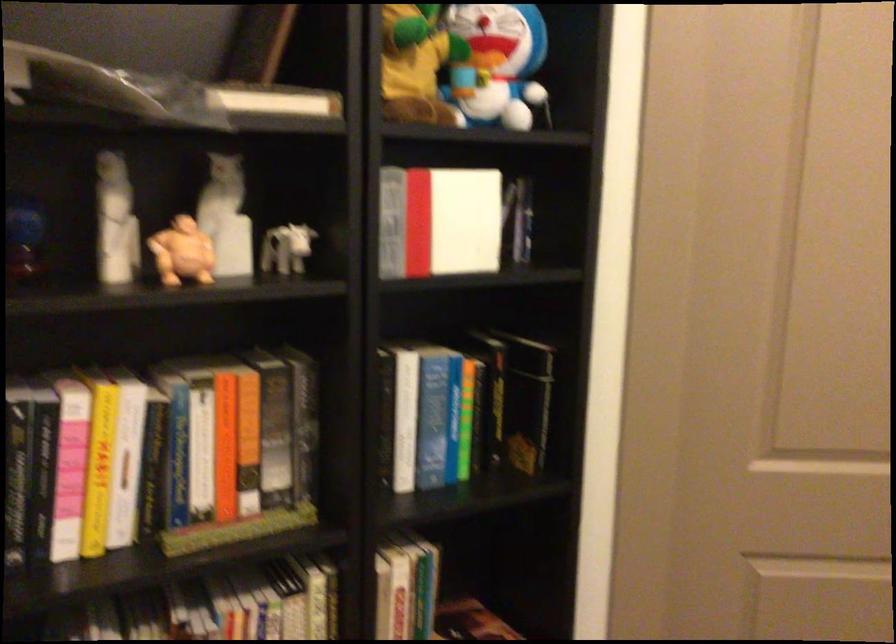
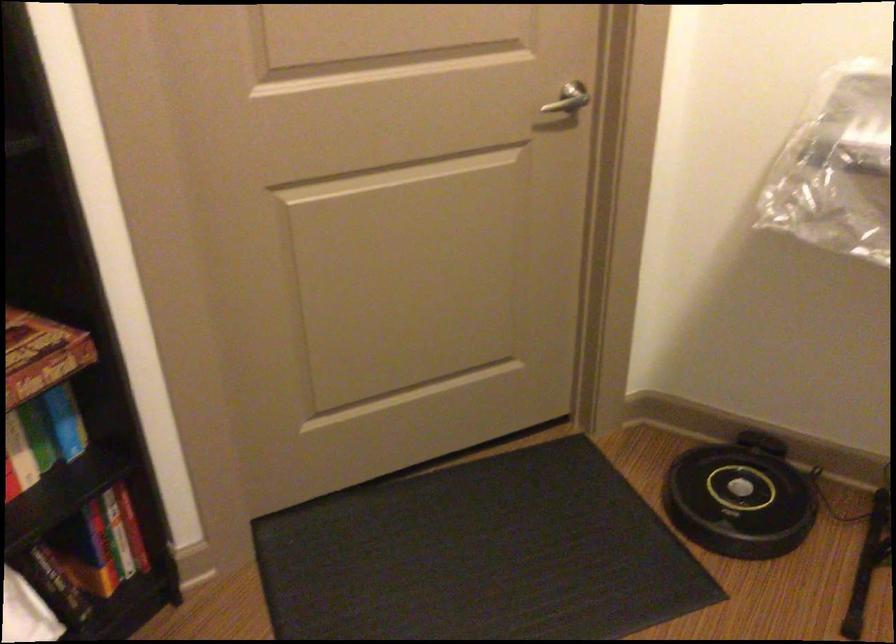
The first image is from the beginning of the video and the second image is from the end. How did the camera likely rotate when shooting the video?

The camera's rotation is toward right-down.